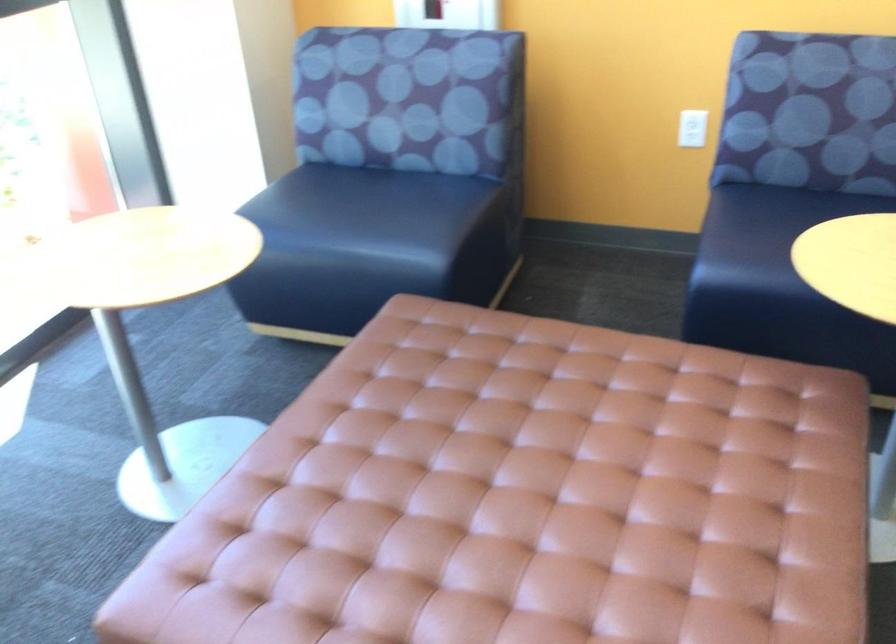
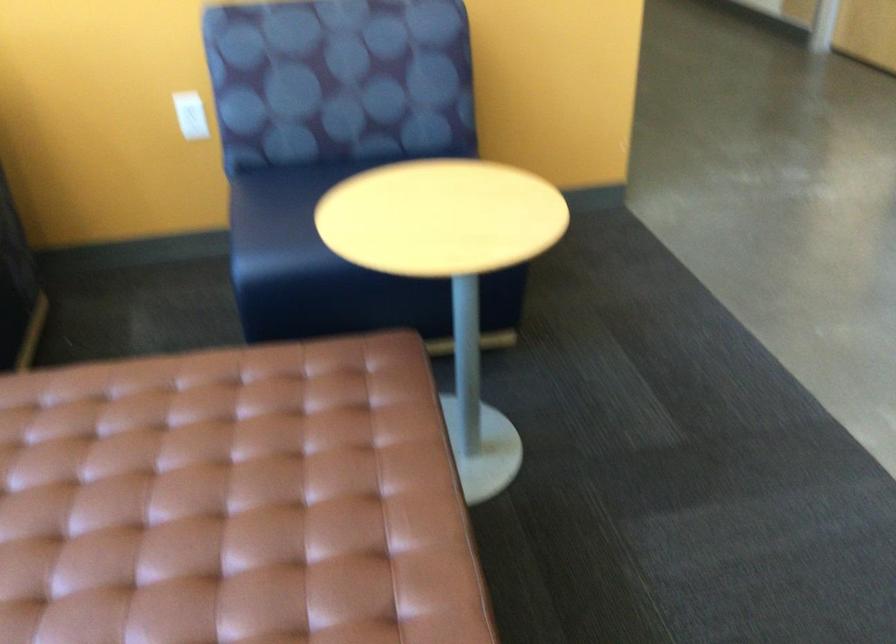
Where in the second image is the point corresponding to (x=754, y=230) from the first image?

(282, 210)